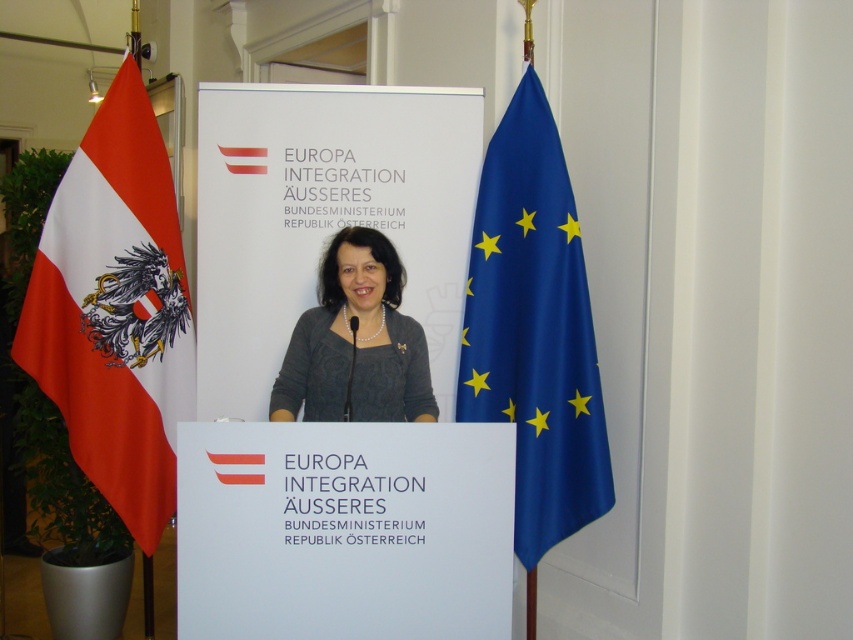
Question: Is blue satin flag at right bigger than matte gray sweater at center?

Choices:
 (A) no
 (B) yes

Answer: (B)

Question: Which point is closer to the camera taking this photo?

Choices:
 (A) (316, 413)
 (B) (468, 376)
 (C) (51, 285)

Answer: (A)

Question: Can you confirm if red fabric flag at left is positioned to the left of matte gray sweater at center?

Choices:
 (A) yes
 (B) no

Answer: (A)

Question: Which point is farther from the camera taking this photo?

Choices:
 (A) (370, 259)
 (B) (74, 292)
 (C) (503, 252)

Answer: (B)

Question: Can you confirm if red fabric flag at left is smaller than matte gray sweater at center?

Choices:
 (A) yes
 (B) no

Answer: (B)

Question: Which of the following is the farthest from the observer?

Choices:
 (A) blue satin flag at right
 (B) matte gray sweater at center

Answer: (A)